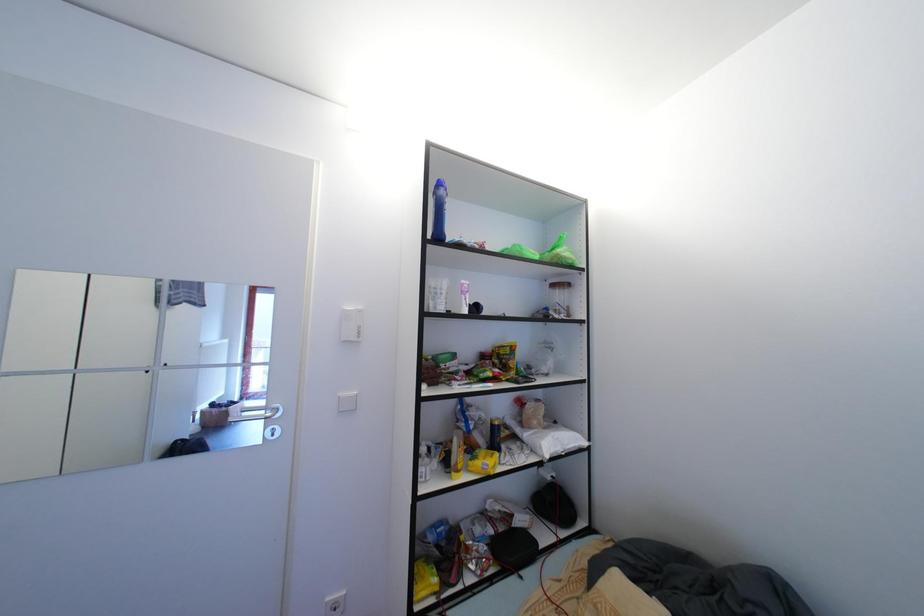
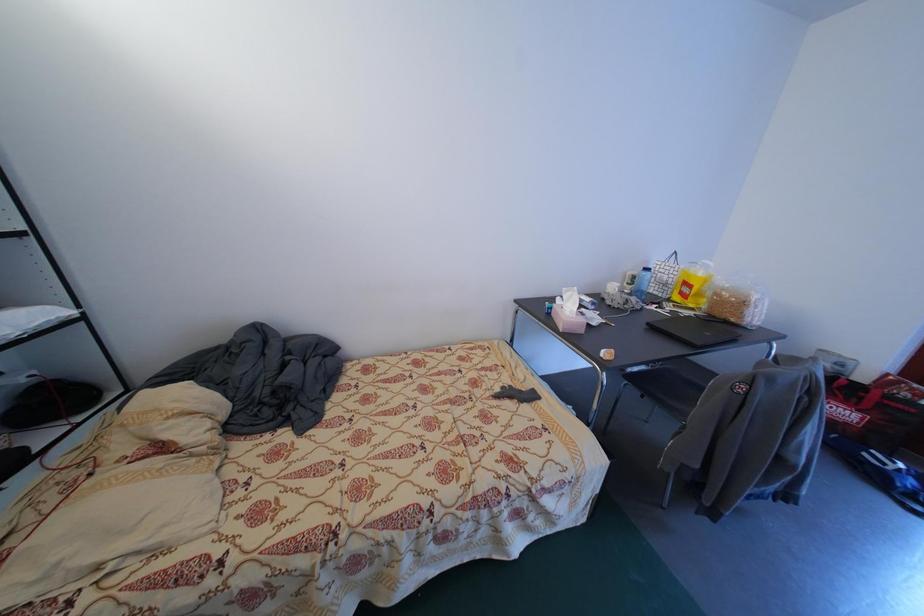
First-person continuous shooting, in which direction is the camera rotating?

The rotation direction of the camera is right-down.